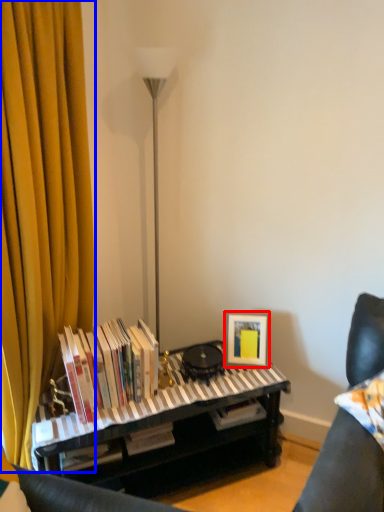
Question: Among these objects, which one is farthest to the camera, picture frame (highlighted by a red box) or curtain (highlighted by a blue box)?

Choices:
 (A) picture frame
 (B) curtain

Answer: (A)